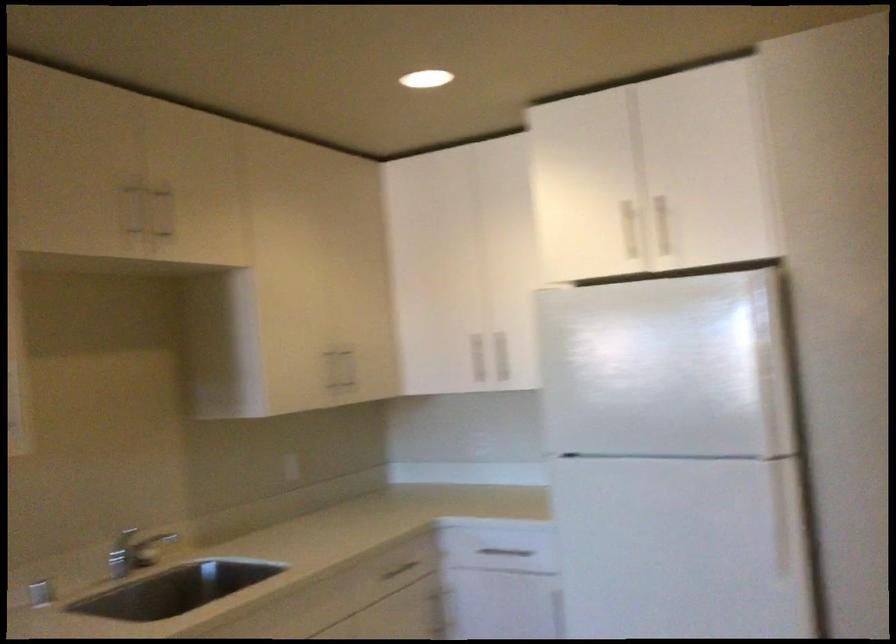
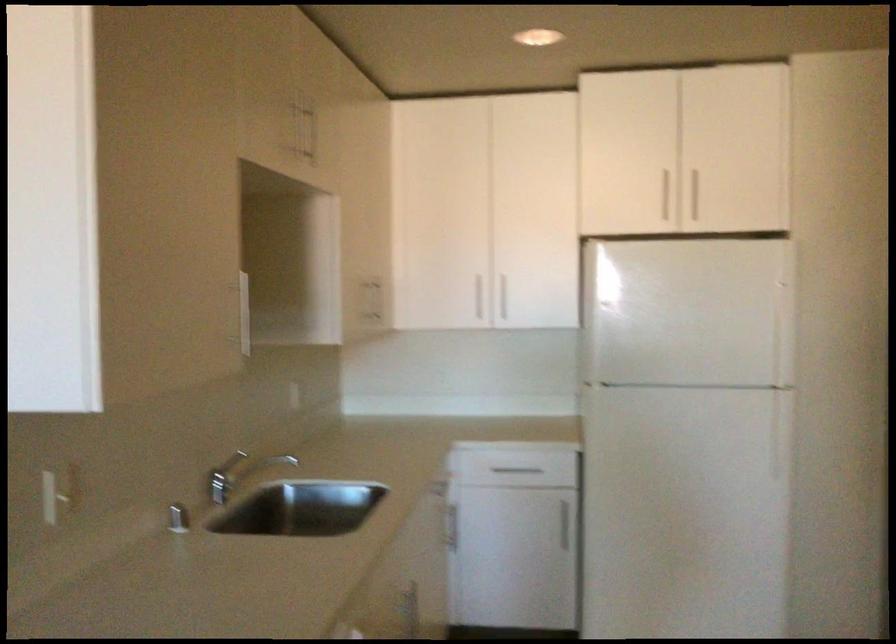
Find the pixel in the second image that matches [474,361] in the first image.

(476, 299)